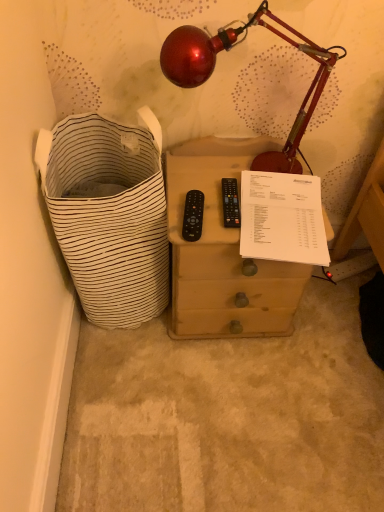
Locate an element on the screen. The width and height of the screenshot is (384, 512). free point behind black plastic remote at center, the 2th control positioned from the right is located at coordinates (198, 180).